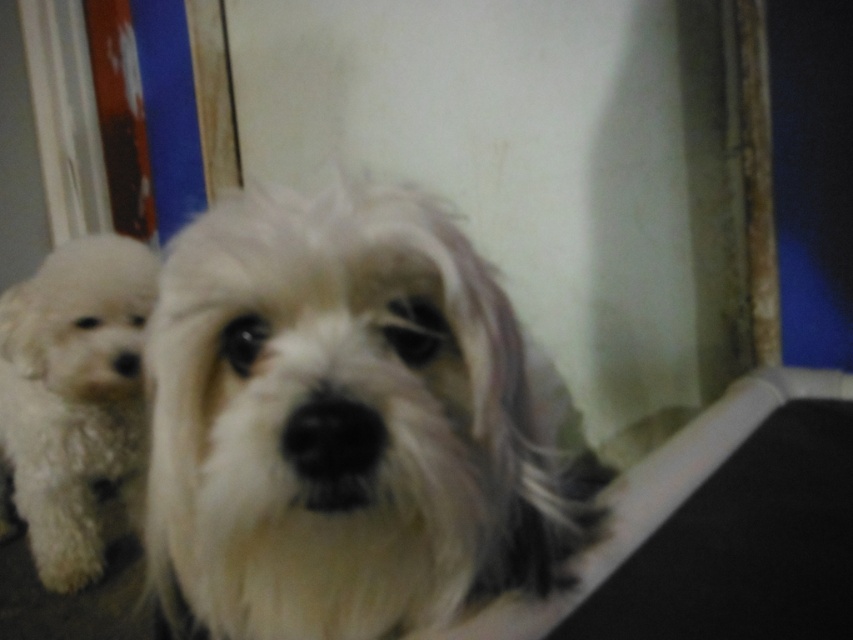
You are a photographer trying to capture both dogs in a single frame. The camera you are using has a depth of field that can focus on subjects within a 1 meter range. Given their positions, will both white fluffy dog at center and white fluffy dog at left be in focus?

The white fluffy dog at center is 1.09 meters away from the white fluffy dog at left. Since the depth of field can only focus within 1 meter, the distance between them exceeds the camera s capability, so only one of the dogs will be in focus.

You are a photographer trying to capture both dogs in the scene. Which dog, the white fluffy dog at center or the white fluffy dog at left, would require you to zoom in more to fill the frame?

The white fluffy dog at center occupies less space in the frame than the white fluffy dog at left, so you would need to zoom in more to fill the frame for the white fluffy dog at center.

Based on the scene description, where is the white fluffy dog at center located in terms of 2D coordinates?

The white fluffy dog at center is located at the 2D coordinates of point (349, 424).